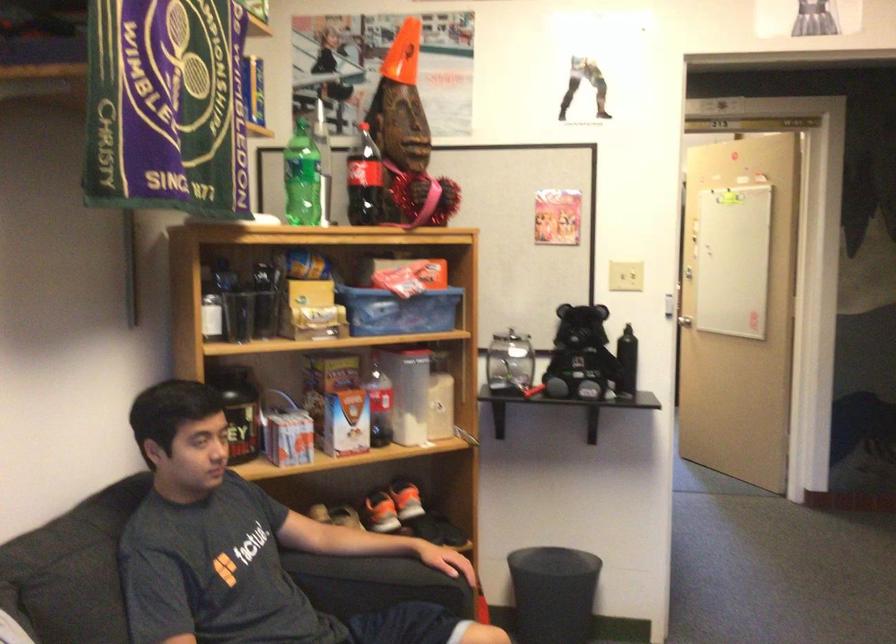
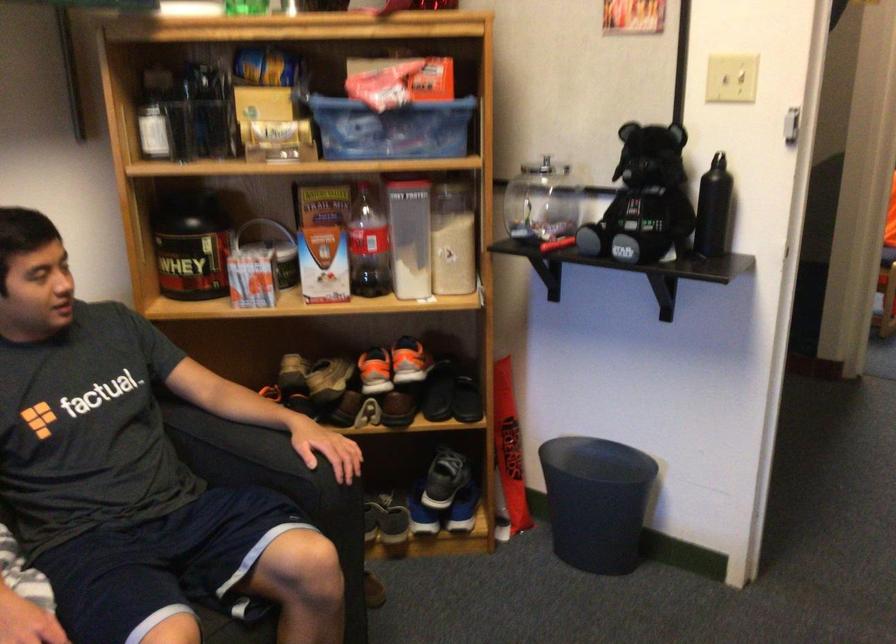
Locate, in the second image, the point that corresponds to point (407, 348) in the first image.

(405, 178)